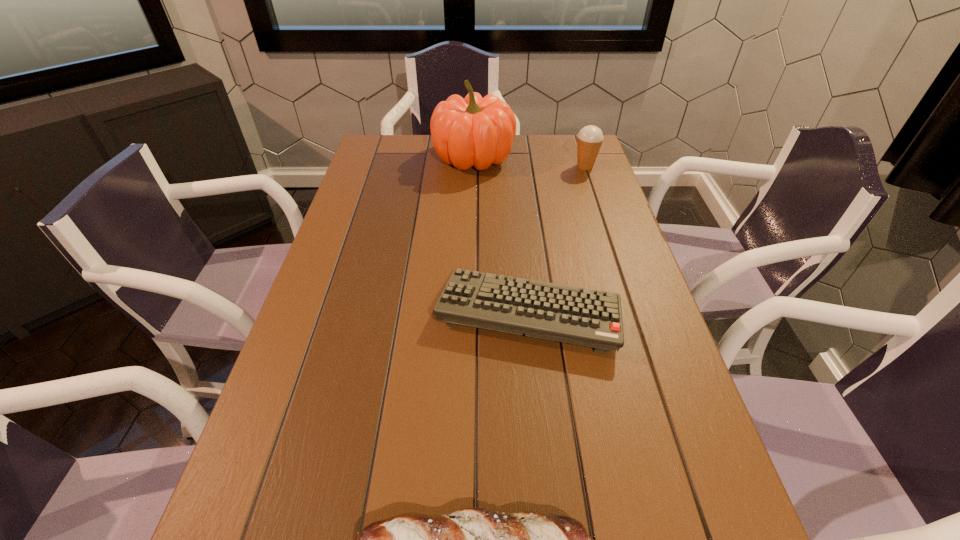
Locate an element on the screen. computer keyboard that is at the right edge is located at coordinates (574, 315).

The width and height of the screenshot is (960, 540). Find the location of `object that is at the far right corner`. object that is at the far right corner is located at coordinates (589, 139).

Locate an element on the screen. This screenshot has height=540, width=960. free space at the left edge of the desktop is located at coordinates 325,411.

Identify the location of vacant space at the right edge of the desktop. The image size is (960, 540). (603, 368).

In the image, there is a desktop. Where is `free space at the far right corner`? The width and height of the screenshot is (960, 540). free space at the far right corner is located at coordinates (556, 139).

Identify the location of free space between the pumpkin and the icecream. (529, 161).

The image size is (960, 540). In order to click on empty space between the tallest object and the computer keyboard in this screenshot , I will do coord(501,234).

Identify the location of vacant space that's between the shortest object and the third shortest object. This screenshot has height=540, width=960. (557, 239).

Locate an element on the screen. unoccupied position between the pumpkin and the icecream is located at coordinates (529, 161).

The height and width of the screenshot is (540, 960). In order to click on free space between the icecream and the computer keyboard in this screenshot , I will do `click(557, 239)`.